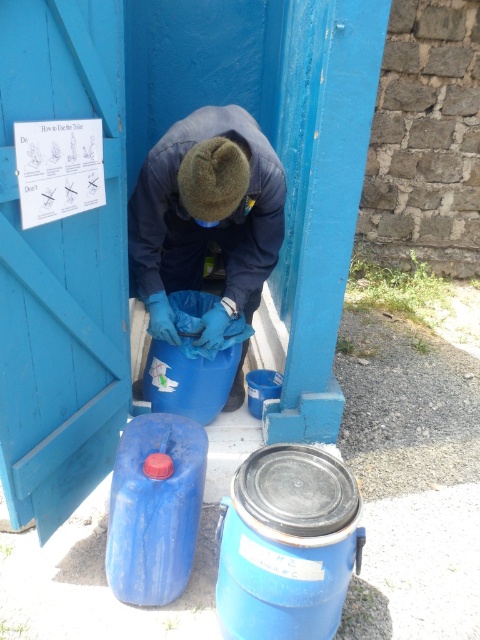
Can you confirm if blue matte gloves at center is smaller than blue plastic barrel at lower left?

Incorrect, blue matte gloves at center is not smaller in size than blue plastic barrel at lower left.

Which is below, blue matte gloves at center or blue plastic barrel at lower left?

blue plastic barrel at lower left is below.

The width and height of the screenshot is (480, 640). I want to click on blue matte gloves at center, so click(x=205, y=218).